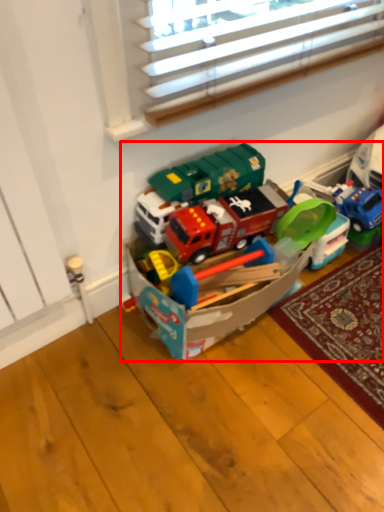
Question: Observing the image, what is the correct spatial positioning of toy (annotated by the red box) in reference to toy?

Choices:
 (A) left
 (B) right

Answer: (A)